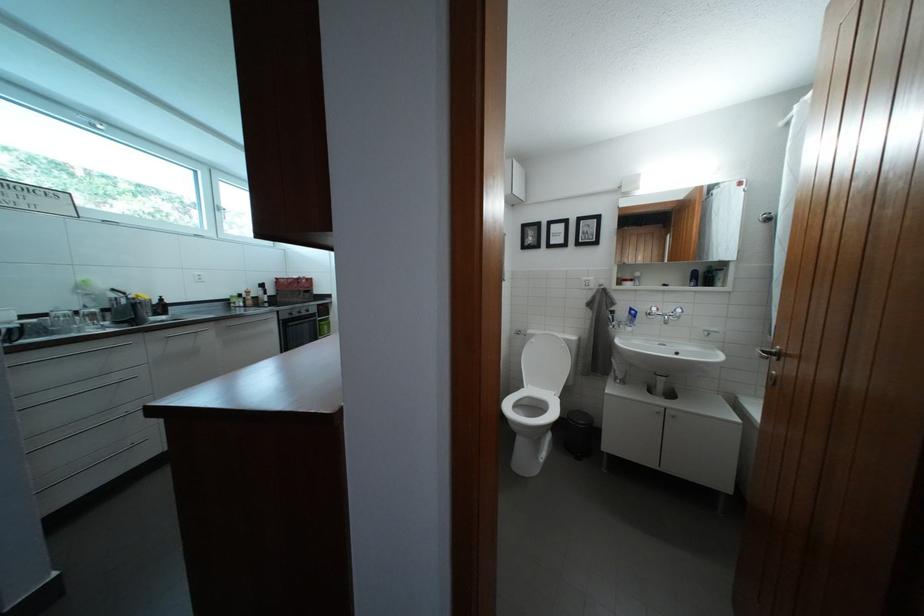
Locate an element on the screen. black pump dispenser is located at coordinates (161, 306).